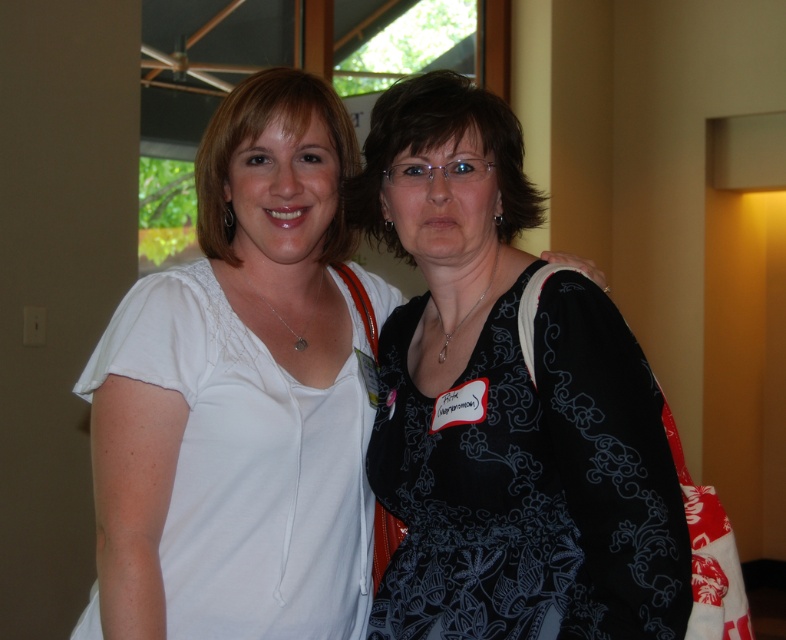
You are at a conference and need to identify the clothing items based on their positions. Which clothing item is positioned lower on the body between the black printed dress at center and the white matte shirt at left?

The black printed dress at center is located below the white matte shirt at left, so it is positioned lower on the body.

You are at a networking event and need to approach the person wearing the white matte shirt at left. Which direction should you move relative to the black printed dress at center?

To reach the white matte shirt at left, you should move to the left of the black printed dress at center since the white matte shirt at left is positioned to the left of the black printed dress at center.

Based on the photo, you are organizing a charity event and need to ensure that all participants can wear their outfits comfortably. Given the black printed dress at center and the white matte shirt at left, which outfit requires more space to move around in?

The white matte shirt at left requires more space to move around in because it is larger than the black printed dress at center.